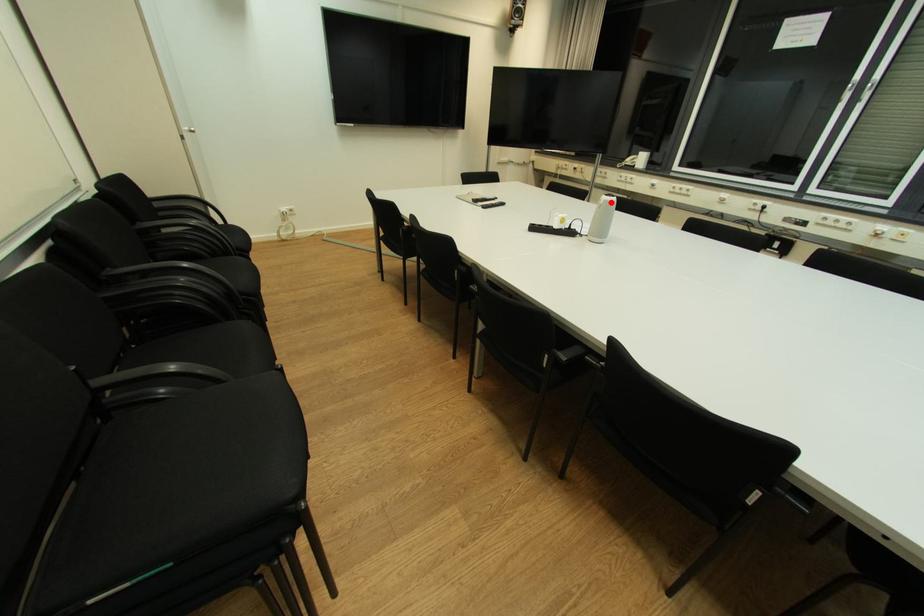
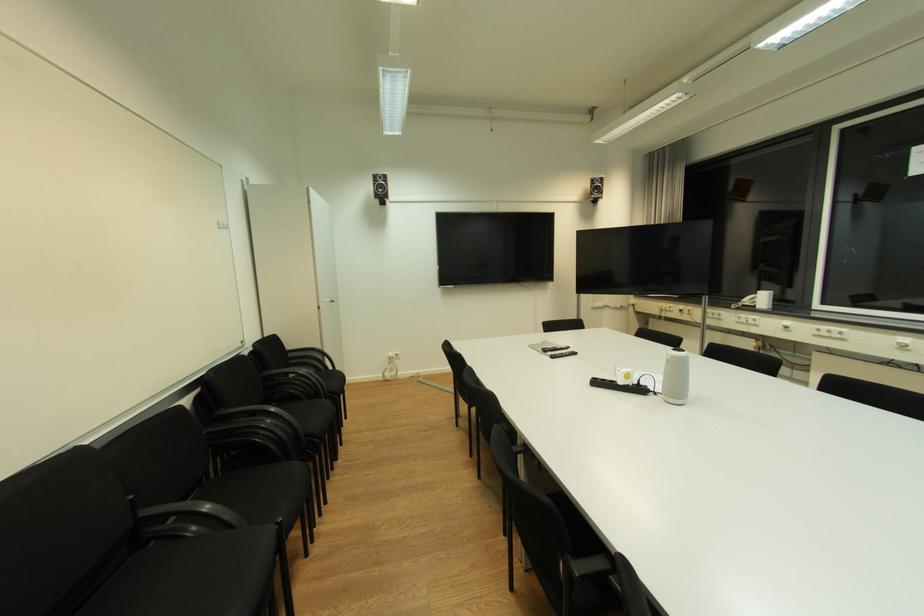
Question: I am providing you with two images of the same scene from different viewpoints. A red point is shown in image1. For the corresponding object point in image2, is it positioned nearer or farther from the camera?

Choices:
 (A) Nearer
 (B) Farther

Answer: (B)